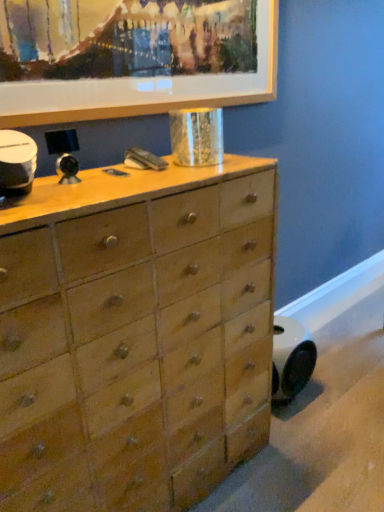
Question: Can you confirm if wooden picture frame at upper center is positioned to the right of natural wood chest of drawers at center?

Choices:
 (A) no
 (B) yes

Answer: (B)

Question: Is wooden picture frame at upper center outside of natural wood chest of drawers at center?

Choices:
 (A) no
 (B) yes

Answer: (B)

Question: Does wooden picture frame at upper center have a greater height compared to natural wood chest of drawers at center?

Choices:
 (A) yes
 (B) no

Answer: (B)

Question: Does wooden picture frame at upper center have a lesser height compared to natural wood chest of drawers at center?

Choices:
 (A) yes
 (B) no

Answer: (A)

Question: From the image's perspective, is wooden picture frame at upper center under natural wood chest of drawers at center?

Choices:
 (A) no
 (B) yes

Answer: (A)

Question: From a real-world perspective, is wooden picture frame at upper center under natural wood chest of drawers at center?

Choices:
 (A) yes
 (B) no

Answer: (B)

Question: Does natural wood chest of drawers at center turn towards wooden picture frame at upper center?

Choices:
 (A) yes
 (B) no

Answer: (B)

Question: Is natural wood chest of drawers at center positioned beyond the bounds of wooden picture frame at upper center?

Choices:
 (A) yes
 (B) no

Answer: (A)

Question: Is natural wood chest of drawers at center closer to camera compared to wooden picture frame at upper center?

Choices:
 (A) yes
 (B) no

Answer: (A)

Question: Is wooden picture frame at upper center a part of natural wood chest of drawers at center?

Choices:
 (A) no
 (B) yes

Answer: (A)

Question: Does natural wood chest of drawers at center have a lesser height compared to wooden picture frame at upper center?

Choices:
 (A) no
 (B) yes

Answer: (A)

Question: Is natural wood chest of drawers at center taller than wooden picture frame at upper center?

Choices:
 (A) yes
 (B) no

Answer: (A)

Question: From their relative heights in the image, would you say natural wood chest of drawers at center is taller or shorter than wooden picture frame at upper center?

Choices:
 (A) tall
 (B) short

Answer: (A)